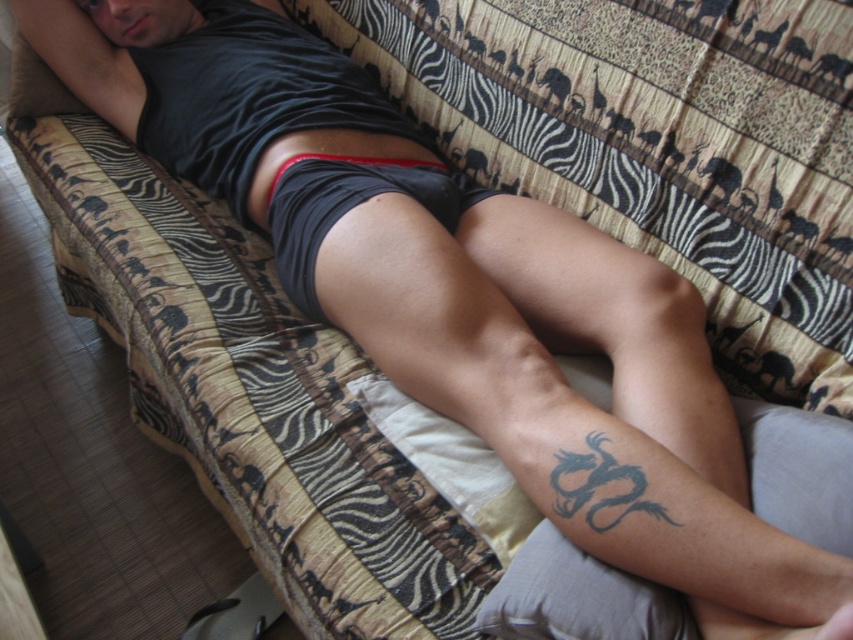
You are a photographer setting up a shoot in this room. You need to position a light source so that it illuminates the black matte shorts at center without casting a shadow on the gray fabric pillow at lower right. Is this possible based on the scene description?

The gray fabric pillow at lower right is located below the black matte shorts at center. Since the pillow is below the shorts, positioning a light source above the black matte shorts at center would illuminate it while casting a shadow downward. However, since the pillow is already below the shorts, the shadow from the shorts would fall onto the pillow, making it impossible to avoid casting a shadow on the pillow. Therefore, it is not possible to illuminate the black matte shorts at center without casting a

You are a photographer setting up a shot of the person on the couch. You need to place a small prop exactly at the 2D coordinates given in the image. Where should you place the prop relative to the gray fabric pillow at lower right?

The gray fabric pillow at lower right is located at the 2D coordinates point (578,596), so the prop should be placed exactly at that point relative to the gray fabric pillow at lower right.

In the scene shown: You are a photographer setting up a shoot in the room. You need to place a small decorative item on the gray fabric pillow at lower right and the black matte shorts at center. Which object can accommodate a larger item without it falling off?

The black matte shorts at center can accommodate a larger item without it falling off because the gray fabric pillow at lower right has a smaller size compared to black matte shorts at center.